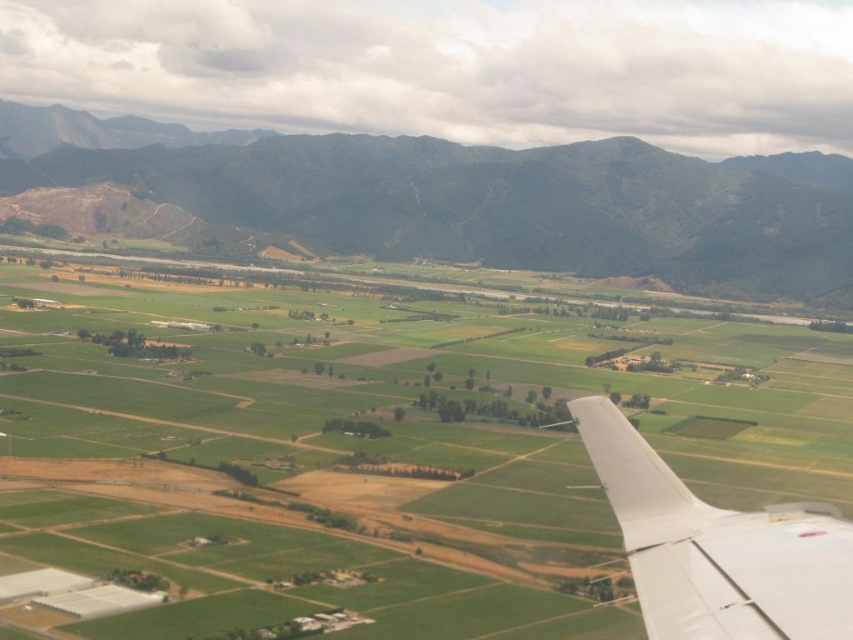
Is green grassland at center bigger than green grassy mountain at upper center?

Correct, green grassland at center is larger in size than green grassy mountain at upper center.

In the scene shown: Can you confirm if green grassland at center is wider than green grassy mountain at upper center?

Incorrect, green grassland at center's width does not surpass green grassy mountain at upper center's.

Which is in front, point (469, 397) or point (766, 288)?

Point (469, 397)

You are a GUI agent. You are given a task and a screenshot of the screen. Output one action in this format:
    pyautogui.click(x=<x>, y=<y>)
    Task: Click on the green grassland at center
    
    Given the screenshot: What is the action you would take?
    pyautogui.click(x=373, y=458)

Is point (305, 404) farther from camera compared to point (637, 515)?

Yes, point (305, 404) is behind point (637, 515).

Does point (538, 476) come closer to viewer compared to point (648, 486)?

No.

Is point (556, 544) positioned in front of point (610, 477)?

No.

Find the location of a particular element. green grassland at center is located at coordinates (373, 458).

Is point (763, 202) behind point (706, 616)?

Yes, point (763, 202) is farther from viewer.

Locate an element on the screen. The width and height of the screenshot is (853, 640). green grassy mountain at upper center is located at coordinates (453, 200).

The width and height of the screenshot is (853, 640). I want to click on green grassy mountain at upper center, so click(x=453, y=200).